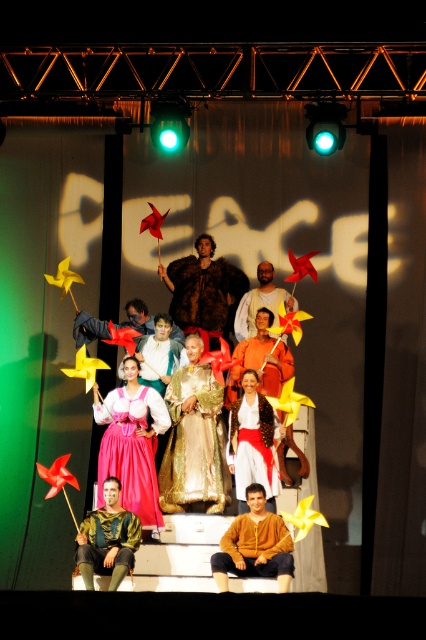
Can you confirm if brown textured shirt at center is wider than gold metallic armor at lower center?

Yes.

Between brown textured shirt at center and gold metallic armor at lower center, which one is positioned lower?

brown textured shirt at center is lower down.

This screenshot has width=426, height=640. In order to click on brown textured shirt at center in this screenshot , I will do `click(255, 545)`.

Between brown textured shirt at center and fur coat at center, which one is positioned lower?

brown textured shirt at center is lower down.

Describe the element at coordinates (255, 545) in the screenshot. I see `brown textured shirt at center` at that location.

Identify the location of brown textured shirt at center. 255,545.

Is gold metallic dress at center taller than orange fabric dress at center?

Correct, gold metallic dress at center is much taller as orange fabric dress at center.

Between point (215, 417) and point (241, 337), which one is positioned behind?

Positioned behind is point (241, 337).

Between point (204, 426) and point (253, 301), which one is positioned behind?

The point (253, 301) is behind.

This screenshot has height=640, width=426. I want to click on gold metallic dress at center, so click(193, 442).